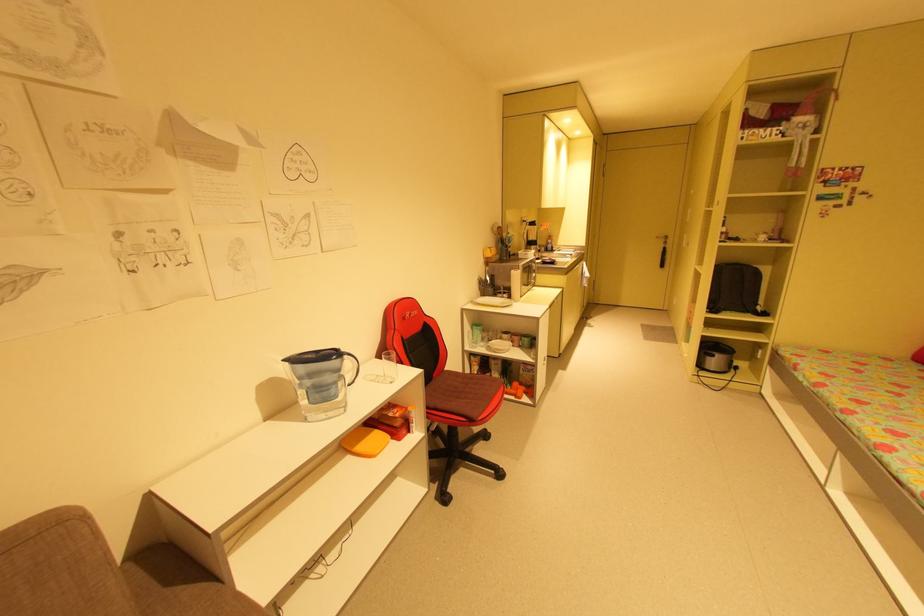
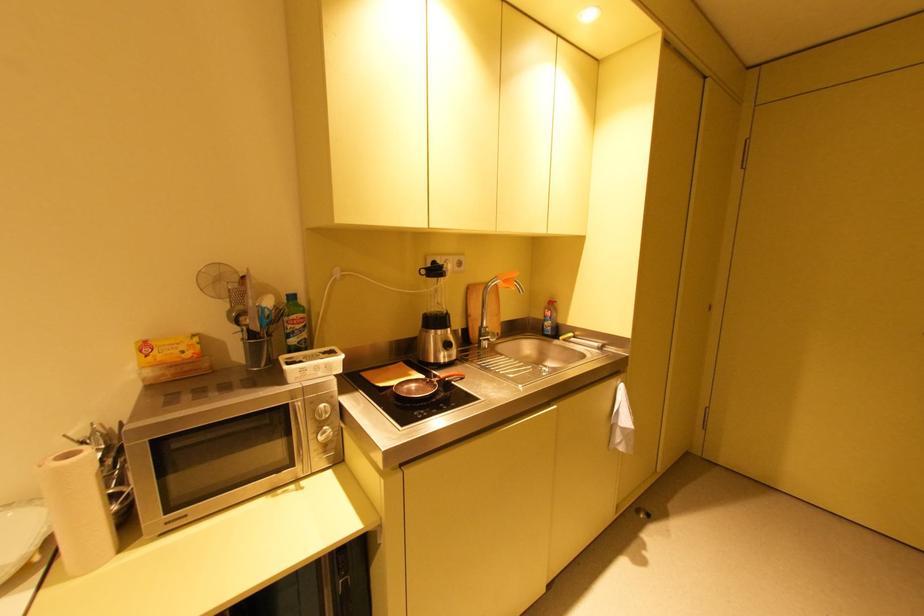
Where in the second image is the point corresponding to [553,246] from the first image?

(551, 323)